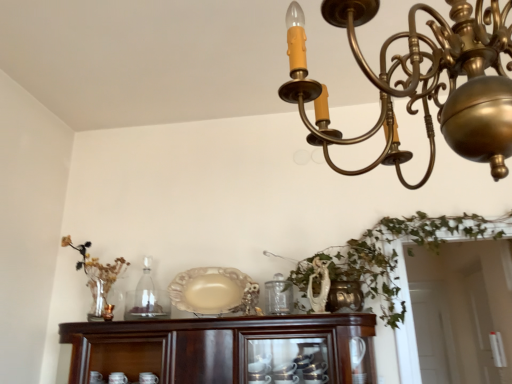
Question: From the image's perspective, is clear glass bottle at center positioned above or below matte gold candle holder at left?

Choices:
 (A) below
 (B) above

Answer: (B)

Question: Considering their positions, is clear glass bottle at center located in front of or behind matte gold candle holder at left?

Choices:
 (A) behind
 (B) front

Answer: (A)

Question: Which object is positioned farthest from the matte gold candle holder at left?

Choices:
 (A) clear glass bottle at center
 (B) mahogany wood cabinet at lower center
 (C) matte beige platter at center
 (D) gold metallic chandelier at upper center

Answer: (D)

Question: Which of these objects is positioned closest to the clear glass bottle at center?

Choices:
 (A) matte gold candle holder at left
 (B) matte beige platter at center
 (C) gold metallic chandelier at upper center
 (D) mahogany wood cabinet at lower center

Answer: (A)